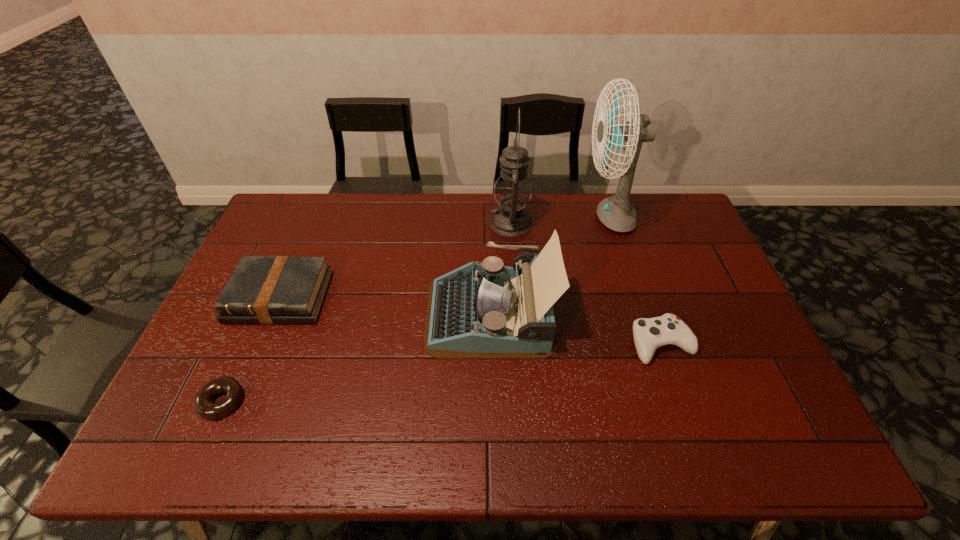
Find the location of `vacant area between the oil lamp and the hardback book`. vacant area between the oil lamp and the hardback book is located at coordinates (396, 260).

Locate an element on the screen. Image resolution: width=960 pixels, height=540 pixels. free spot between the second shortest object and the third tallest object is located at coordinates (576, 328).

Identify the location of vacant region between the typewriter and the control. (576, 328).

Locate an element on the screen. The width and height of the screenshot is (960, 540). vacant space in between the third tallest object and the fourth tallest object is located at coordinates (385, 305).

The image size is (960, 540). What are the coordinates of `free point between the fan and the oil lamp` in the screenshot? It's located at 560,220.

Identify the location of vacant area that lies between the third shortest object and the doughnut. This screenshot has height=540, width=960. (252, 349).

Identify which object is the second closest to the fourth shortest object. Please provide its 2D coordinates. Your answer should be formatted as a tuple, i.e. [(x, y)], where the tuple contains the x and y coordinates of a point satisfying the conditions above.

[(649, 334)]

Locate an element on the screen. Image resolution: width=960 pixels, height=540 pixels. the fifth closest object to the second shortest object is located at coordinates (203, 404).

What are the coordinates of `blank area in the image that satisfies the following two spatial constraints: 1. on the back side of the doughnut; 2. on the right side of the oil lamp` in the screenshot? It's located at (301, 224).

Find the location of a particular element. The image size is (960, 540). vacant position in the image that satisfies the following two spatial constraints: 1. on the front-facing side of the fan; 2. on the right side of the control is located at coordinates (650, 343).